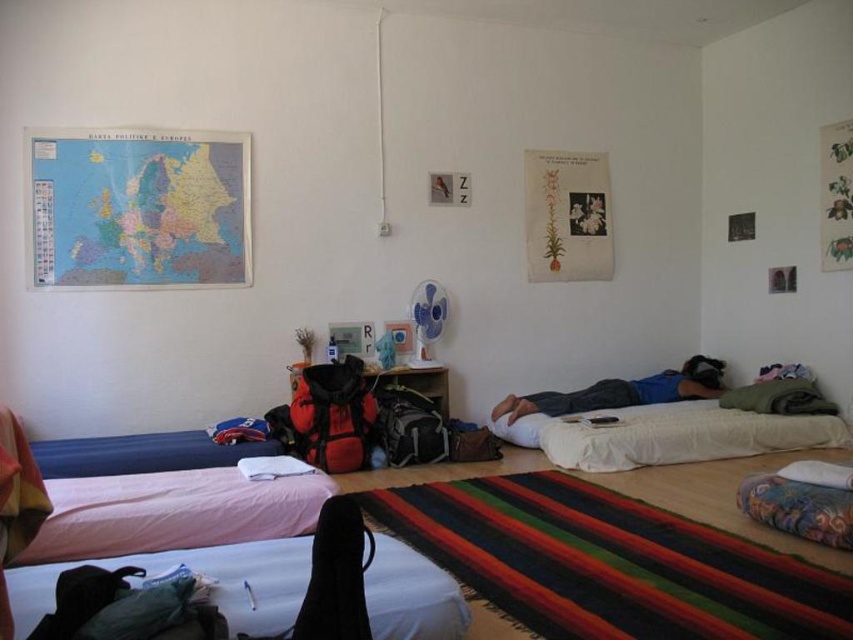
In the scene shown: You are organizing a laundry day in the hostel room described. You need to determine which item, the pink fabric bed at lower left or the blue cotton shirt at center, requires more space when stored. Based on their sizes, which one should you allocate more storage space for?

The pink fabric bed at lower left has a larger size compared to the blue cotton shirt at center, so you should allocate more storage space for the pink fabric bed at lower left.

You are standing in the center of the room and need to reach the white soft bed at lower right. According to the coordinates provided, in which direction should you move from the center to get to the bed?

The white soft bed at lower right is located at point (668, 435), which means you should move towards the lower right direction from the center to reach it.